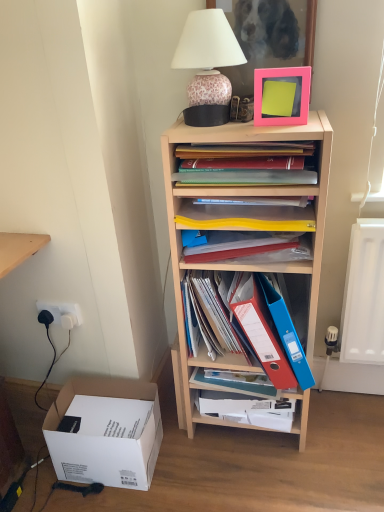
Identify the location of free location to the right of wooden shelf at center. Image resolution: width=384 pixels, height=512 pixels. (345, 419).